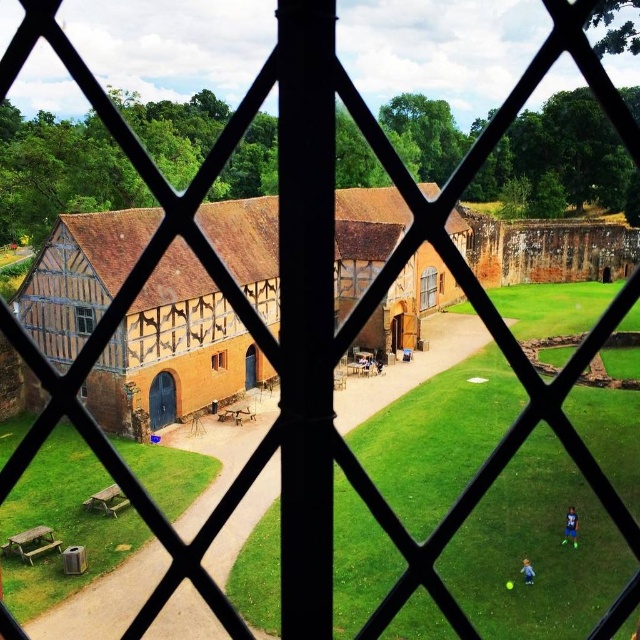
Which is more to the right, matte brown wooden window at center or brown wooden window at center?

matte brown wooden window at center is more to the right.

Is matte brown wooden window at center smaller than brown wooden window at center?

Incorrect, matte brown wooden window at center is not smaller in size than brown wooden window at center.

Which is in front, point (426, 278) or point (218, 355)?

Point (218, 355)

The width and height of the screenshot is (640, 640). Identify the location of matte brown wooden window at center. (428, 289).

Based on the photo, can you confirm if matte brown wooden window at center is shorter than wooden lattice window at center?

No.

Is point (422, 304) farther from camera compared to point (86, 321)?

Yes, it is behind point (86, 321).

Does point (426, 278) come closer to viewer compared to point (77, 307)?

No, (426, 278) is further to viewer.

At what (x,y) coordinates should I click in order to perform the action: click on matte brown wooden window at center. Please return your answer as a coordinate pair (x, y). Image resolution: width=640 pixels, height=640 pixels. Looking at the image, I should click on (428, 289).

Does wooden lattice window at center appear under brown wooden window at center?

No.

Identify the location of wooden lattice window at center. (83, 320).